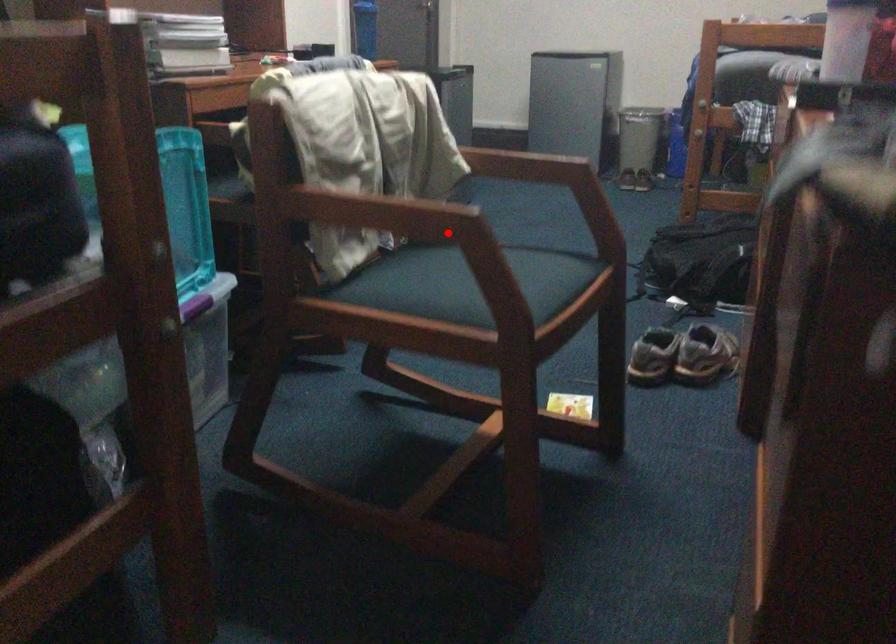
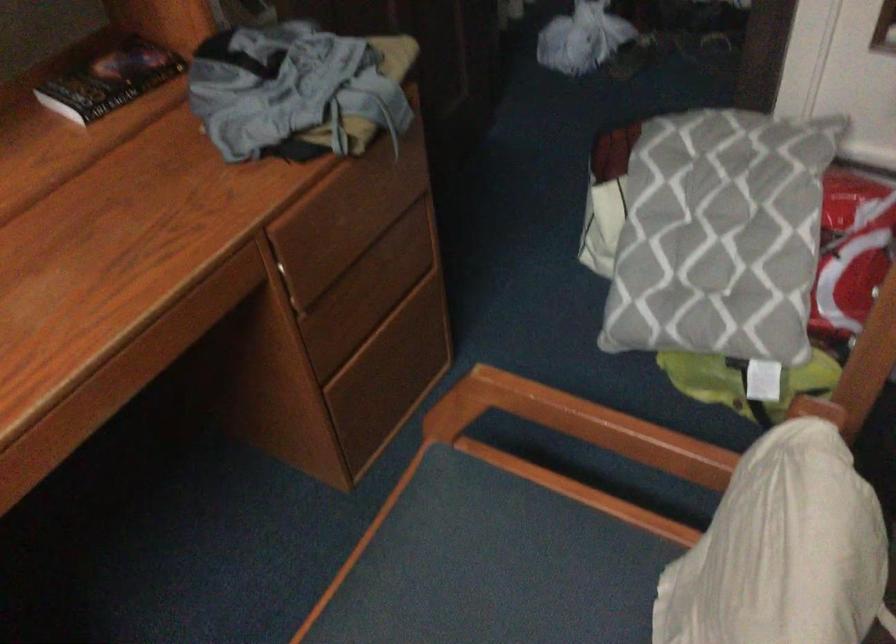
Question: I am providing you with two images of the same scene from different viewpoints. In image1, a red point is highlighted. Considering the same 3D point in image2, which of the following is correct?

Choices:
 (A) It is closer
 (B) It is farther

Answer: (A)